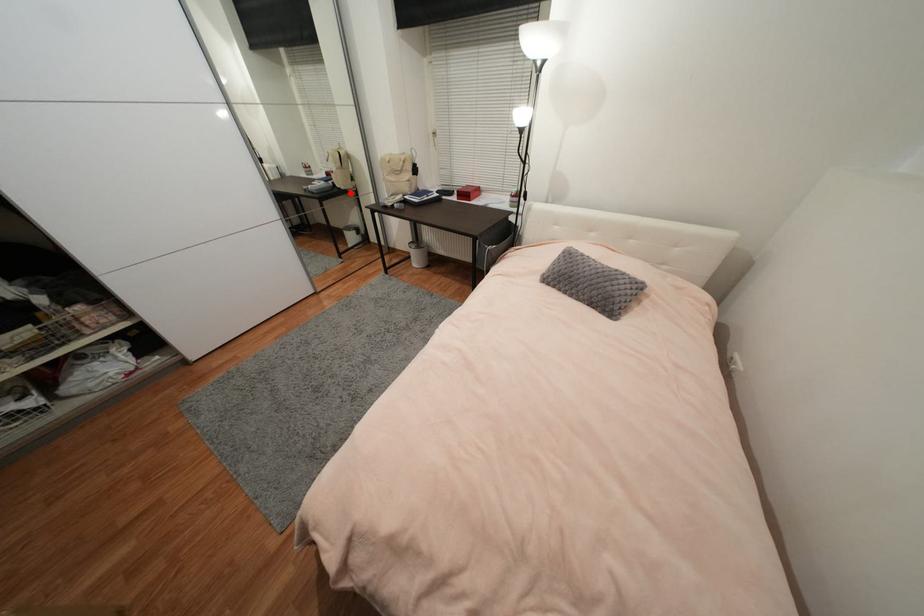
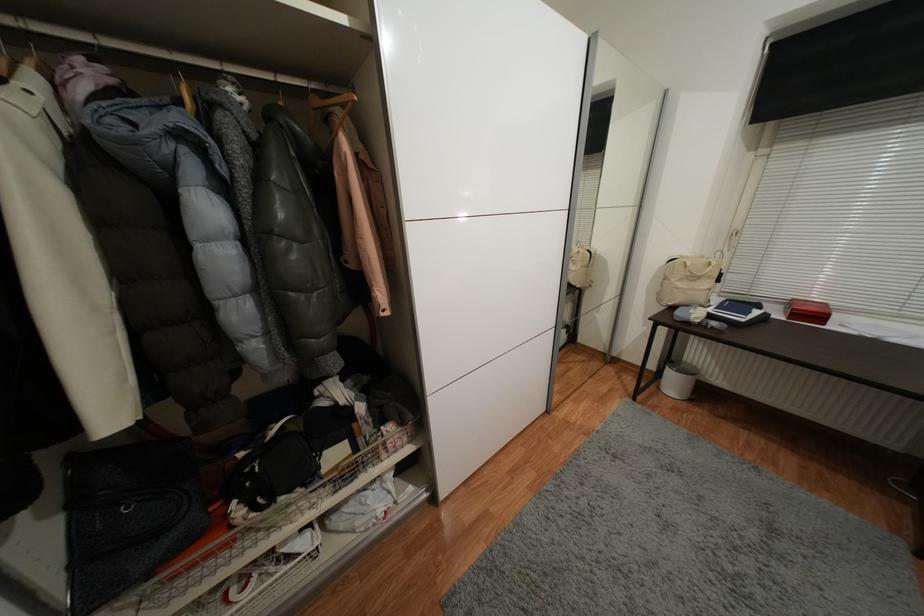
Question: I am providing you with two images of the same scene from different viewpoints. A red point is marked on the first image. Can you still see the location of the red point in image 2?

Choices:
 (A) Yes
 (B) No

Answer: (A)